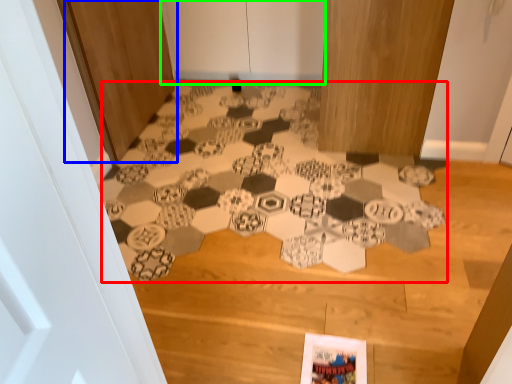
Question: Estimate the real-world distances between objects in this image. Which object is farther from print (highlighted by a red box), door (highlighted by a blue box) or door (highlighted by a green box)?

Choices:
 (A) door
 (B) door

Answer: (B)